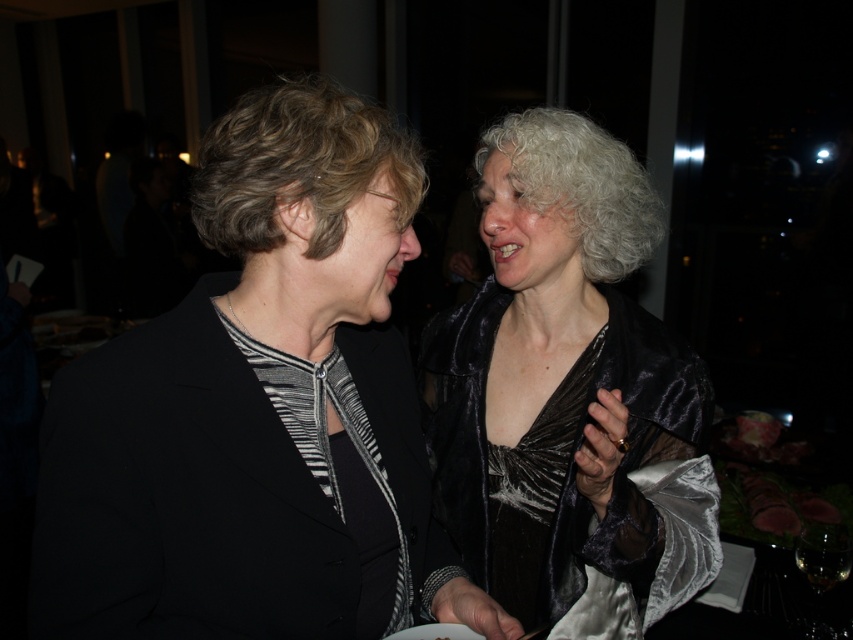
Can you confirm if matte black blazer at left is wider than satin black dress at right?

Yes.

Between matte black blazer at left and satin black dress at right, which one has more height?

With more height is satin black dress at right.

In order to click on matte black blazer at left in this screenshot , I will do `click(259, 412)`.